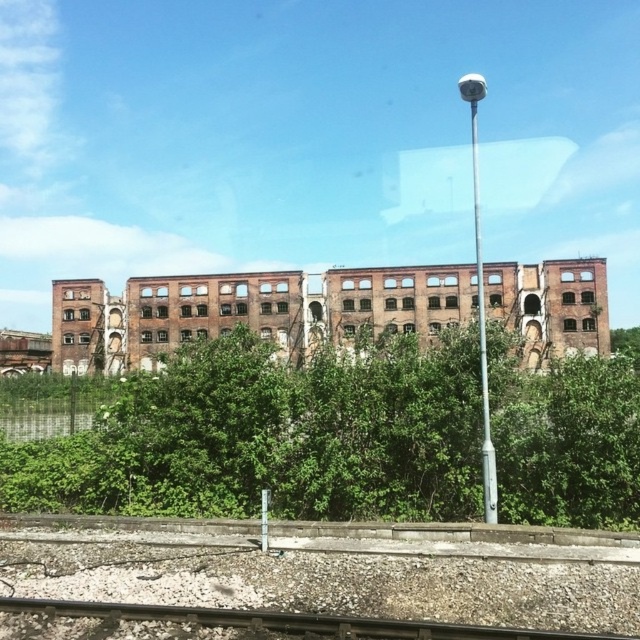
Which of these two, green leafy tree at center or smooth metal train track at bottom center, stands shorter?

smooth metal train track at bottom center is shorter.

Who is taller, green leafy tree at center or smooth metal train track at bottom center?

green leafy tree at center

Describe the element at coordinates (272, 436) in the screenshot. This screenshot has height=640, width=640. I see `green leafy tree at center` at that location.

Image resolution: width=640 pixels, height=640 pixels. I want to click on green leafy tree at center, so click(x=272, y=436).

Can you confirm if green leafy tree at center is smaller than brown brick building at center?

Correct, green leafy tree at center occupies less space than brown brick building at center.

Which is behind, point (348, 368) or point (422, 280)?

Positioned behind is point (422, 280).

Who is more distant from viewer, (202, 408) or (540, 323)?

The point (540, 323) is more distant.

Identify the location of green leafy tree at center. The image size is (640, 640). (272, 436).

Based on the photo, who is taller, brown brick building at center or smooth metal train track at bottom center?

With more height is brown brick building at center.

Can you confirm if brown brick building at center is smaller than smooth metal train track at bottom center?

Incorrect, brown brick building at center is not smaller in size than smooth metal train track at bottom center.

This screenshot has height=640, width=640. I want to click on brown brick building at center, so click(252, 310).